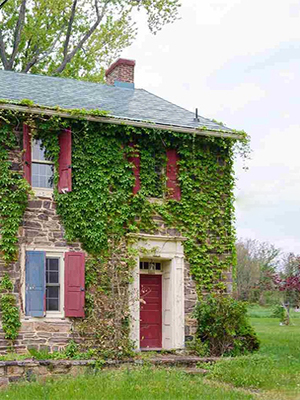
At what (x,y) coordinates should I click in order to perform the action: click on chimney. Please return your answer as a coordinate pair (x, y). Image resolution: width=300 pixels, height=400 pixels. Looking at the image, I should click on (120, 75).